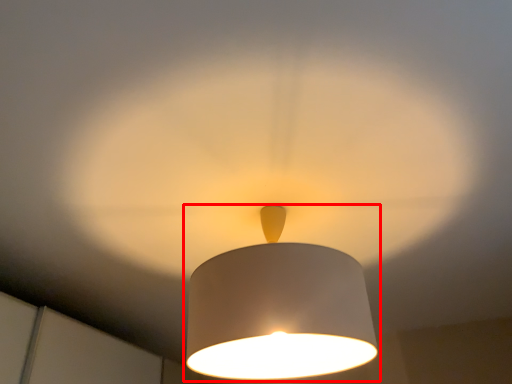
Question: From the image's perspective, where is lamp (annotated by the red box) located in relation to glow in the image?

Choices:
 (A) below
 (B) above

Answer: (B)